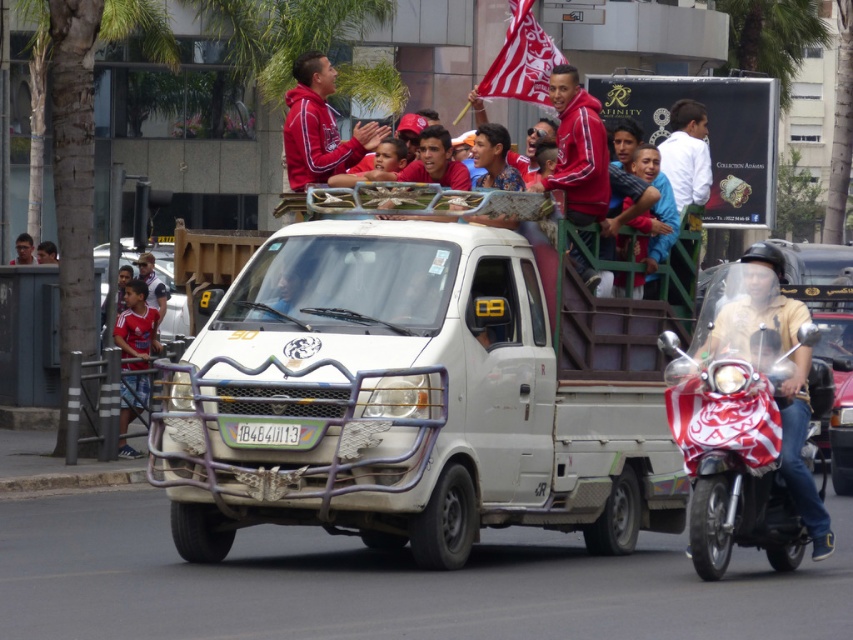
Looking at this image, can you confirm if red fleece jacket at upper center is positioned to the right of red jersey at left?

Correct, you'll find red fleece jacket at upper center to the right of red jersey at left.

Who is more forward, (346, 168) or (125, 326)?

Point (346, 168) is in front.

Find the location of `red fleece jacket at upper center`. red fleece jacket at upper center is located at coordinates (318, 125).

Between point (683, 420) and point (300, 170), which one is positioned in front?

Point (683, 420) is more forward.

Between red and white fabric covered scooter at right and red fleece jacket at upper center, which one has less height?

red and white fabric covered scooter at right is shorter.

Does point (689, 444) lie in front of point (322, 96)?

Yes, it is.

At what (x,y) coordinates should I click in order to perform the action: click on red and white fabric covered scooter at right. Please return your answer as a coordinate pair (x, y). This screenshot has height=640, width=853. Looking at the image, I should click on (732, 456).

Who is positioned more to the right, red and white fabric covered scooter at right or red/white fabric flag at upper center?

Positioned to the right is red and white fabric covered scooter at right.

Find the location of a particular element. This screenshot has height=640, width=853. red and white fabric covered scooter at right is located at coordinates (732, 456).